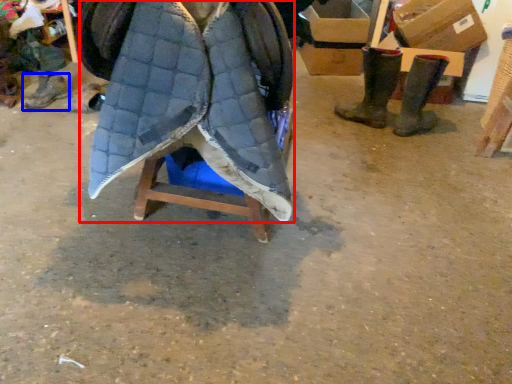
Question: Which object is further to the camera taking this photo, cloak (highlighted by a red box) or footwear (highlighted by a blue box)?

Choices:
 (A) cloak
 (B) footwear

Answer: (B)